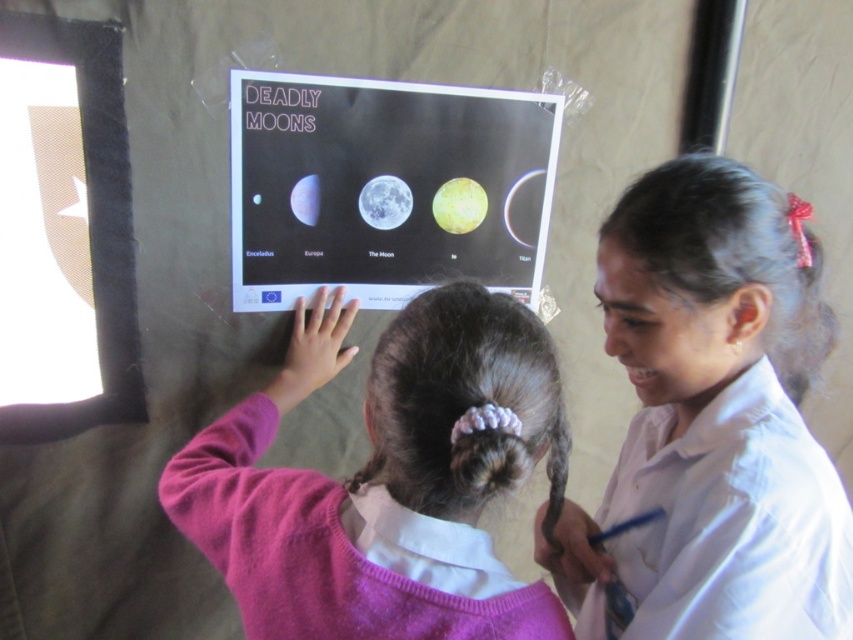
Between matte paper poster at upper center and smooth yellowish-green sphere at center, which one has more height?

With more height is matte paper poster at upper center.

Can you confirm if matte paper poster at upper center is positioned below smooth yellowish-green sphere at center?

Actually, matte paper poster at upper center is above smooth yellowish-green sphere at center.

Is point (527, 115) farther from camera compared to point (474, 186)?

No, it is not.

The width and height of the screenshot is (853, 640). I want to click on matte paper poster at upper center, so click(381, 186).

Who is lower down, white shirt at upper right or smooth yellowish-green sphere at center?

white shirt at upper right is lower down.

Between point (810, 337) and point (473, 212), which one is positioned behind?

Point (473, 212)

Find the location of `white shirt at upper right`. white shirt at upper right is located at coordinates [x=712, y=420].

What do you see at coordinates (712, 420) in the screenshot?
I see `white shirt at upper right` at bounding box center [712, 420].

Which of these two, white shirt at upper right or matte paper poster at upper center, stands shorter?

matte paper poster at upper center

Which is in front, point (639, 573) or point (471, 163)?

Positioned in front is point (639, 573).

Where is `white shirt at upper right`? white shirt at upper right is located at coordinates (712, 420).